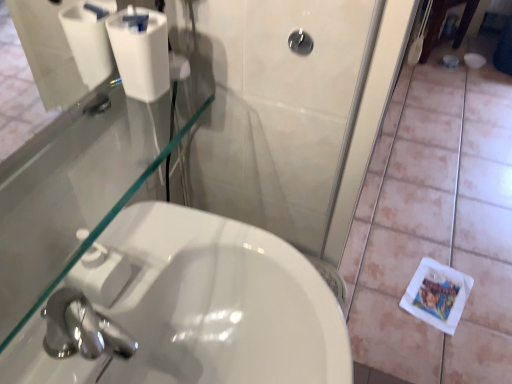
Question: Considering the positions of white matte tile at lower right and white matte toilet paper at upper left in the image, is white matte tile at lower right taller or shorter than white matte toilet paper at upper left?

Choices:
 (A) tall
 (B) short

Answer: (B)

Question: Is white matte tile at lower right situated inside white matte toilet paper at upper left or outside?

Choices:
 (A) outside
 (B) inside

Answer: (A)

Question: Which object is positioned farthest from the black glossy showerhead at upper center?

Choices:
 (A) white glossy sink at lower left
 (B) white matte toilet paper at upper left
 (C) white matte tile at lower right

Answer: (C)

Question: Which object is the closest to the white matte toilet paper at upper left?

Choices:
 (A) white matte tile at lower right
 (B) black glossy showerhead at upper center
 (C) white glossy sink at lower left

Answer: (B)